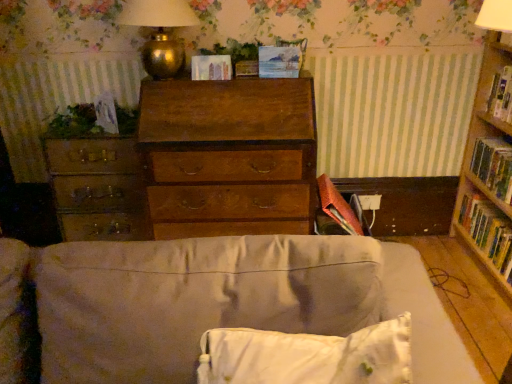
Question: Can you confirm if hardcover book at right, positioned as the 1th paperback book in right-to-left order, is wider than green leafy plant at left, which is the second plant from top to bottom?

Choices:
 (A) no
 (B) yes

Answer: (B)

Question: Considering the relative sizes of hardcover book at right, positioned as the 1th paperback book in right-to-left order, and green leafy plant at left, which is the second plant from top to bottom, in the image provided, is hardcover book at right, positioned as the 1th paperback book in right-to-left order, smaller than green leafy plant at left, which is the second plant from top to bottom,?

Choices:
 (A) no
 (B) yes

Answer: (A)

Question: Can you confirm if hardcover book at right, which is the 1th paperback book from bottom to top, is thinner than green leafy plant at left, marked as the 2th plant in a right-to-left arrangement?

Choices:
 (A) yes
 (B) no

Answer: (B)

Question: Considering the relative sizes of hardcover book at right, which is the 1th paperback book from bottom to top, and green leafy plant at left, which is the second plant from top to bottom, in the image provided, is hardcover book at right, which is the 1th paperback book from bottom to top, bigger than green leafy plant at left, which is the second plant from top to bottom,?

Choices:
 (A) no
 (B) yes

Answer: (B)

Question: Is hardcover book at right, which is the third paperback book in top-to-bottom order, positioned behind green leafy plant at left, which is the second plant from top to bottom?

Choices:
 (A) yes
 (B) no

Answer: (B)

Question: Is hardcover book at right, positioned as the 1th paperback book in right-to-left order, taller than green leafy plant at left, which is counted as the 1th plant, starting from the left?

Choices:
 (A) yes
 (B) no

Answer: (A)

Question: Is gold metallic table lamp at upper center surrounded by hardcover book at right, which is the third paperback book in top-to-bottom order?

Choices:
 (A) no
 (B) yes

Answer: (A)

Question: Does hardcover book at right, which is the 1th paperback book from bottom to top, have a larger size compared to gold metallic table lamp at upper center?

Choices:
 (A) yes
 (B) no

Answer: (B)

Question: Can you confirm if hardcover book at right, which is the third paperback book in top-to-bottom order, is smaller than gold metallic table lamp at upper center?

Choices:
 (A) yes
 (B) no

Answer: (A)

Question: Is hardcover book at right, positioned as the 1th paperback book in right-to-left order, facing towards gold metallic table lamp at upper center?

Choices:
 (A) yes
 (B) no

Answer: (B)

Question: Does hardcover book at right, the third paperback book in the left-to-right sequence, have a greater height compared to gold metallic table lamp at upper center?

Choices:
 (A) no
 (B) yes

Answer: (A)

Question: Can you confirm if hardcover book at right, the third paperback book in the left-to-right sequence, is positioned to the left of gold metallic table lamp at upper center?

Choices:
 (A) no
 (B) yes

Answer: (A)

Question: Is wooden file cabinet at left surrounded by white soft pillow at lower center?

Choices:
 (A) yes
 (B) no

Answer: (B)